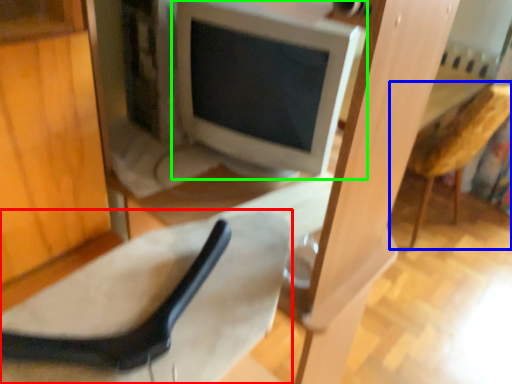
Question: Estimate the real-world distances between objects in this image. Which object is closer to chair (highlighted by a red box), armchair (highlighted by a blue box) or computer monitor (highlighted by a green box)?

Choices:
 (A) armchair
 (B) computer monitor

Answer: (B)